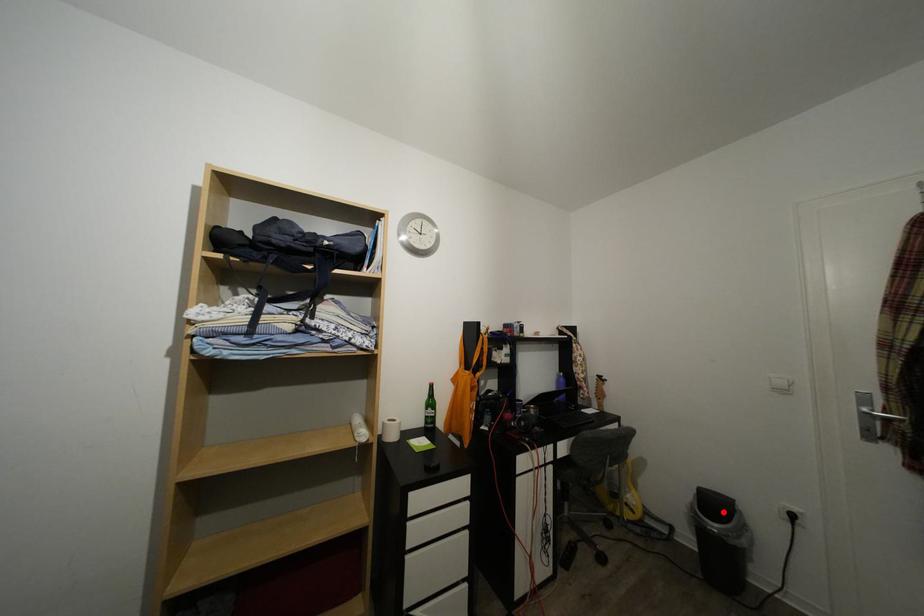
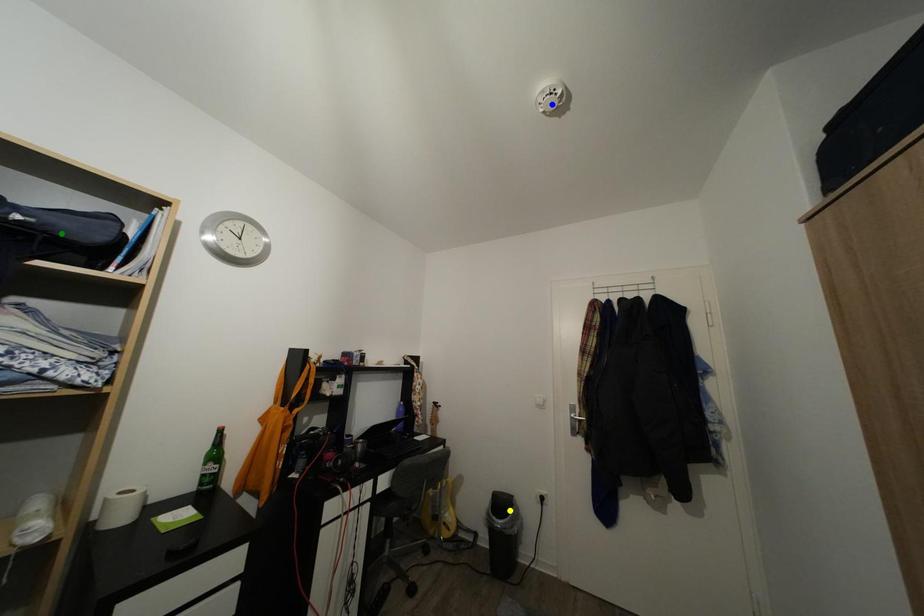
Question: I am providing you with two images of the same scene from different viewpoints. A red point is marked on the first image. You are given multiple points on the second image. In image 2, which mark is for the same physical point as the one in image 1?

Choices:
 (A) yellow point
 (B) green point
 (C) blue point

Answer: (A)